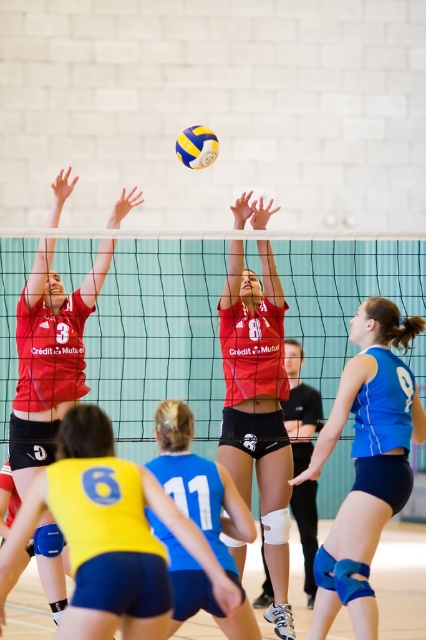
Question: Among these points, which one is farthest from the camera?

Choices:
 (A) (34, 438)
 (B) (367, 568)
 (C) (216, 616)

Answer: (A)

Question: Can you confirm if yellow matte/vinyl shorts at center is positioned to the right of matte red jersey at center?

Choices:
 (A) yes
 (B) no

Answer: (A)

Question: Among these objects, which one is farthest from the camera?

Choices:
 (A) matte red jersey at center
 (B) blue jersey at center

Answer: (A)

Question: Which is nearer to the blue matte knee pads at center?

Choices:
 (A) yellow matte/vinyl shorts at center
 (B) green mesh net at center

Answer: (A)

Question: Considering the relative positions of green mesh net at center and yellow matte/vinyl shorts at center in the image provided, where is green mesh net at center located with respect to yellow matte/vinyl shorts at center?

Choices:
 (A) below
 (B) above

Answer: (B)

Question: Does green mesh net at center have a greater width compared to yellow matte/vinyl shorts at center?

Choices:
 (A) yes
 (B) no

Answer: (A)